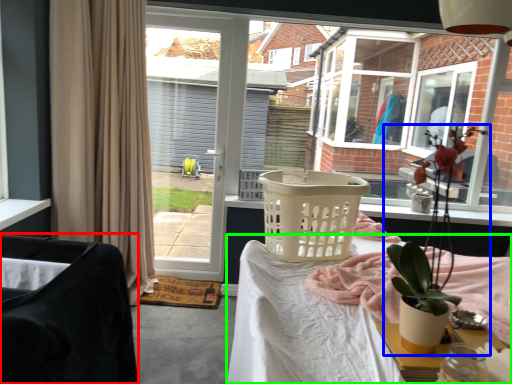
Question: Which object is positioned closest to chair (highlighted by a red box)? Select from houseplant (highlighted by a blue box) and desk (highlighted by a green box).

Choices:
 (A) houseplant
 (B) desk

Answer: (B)